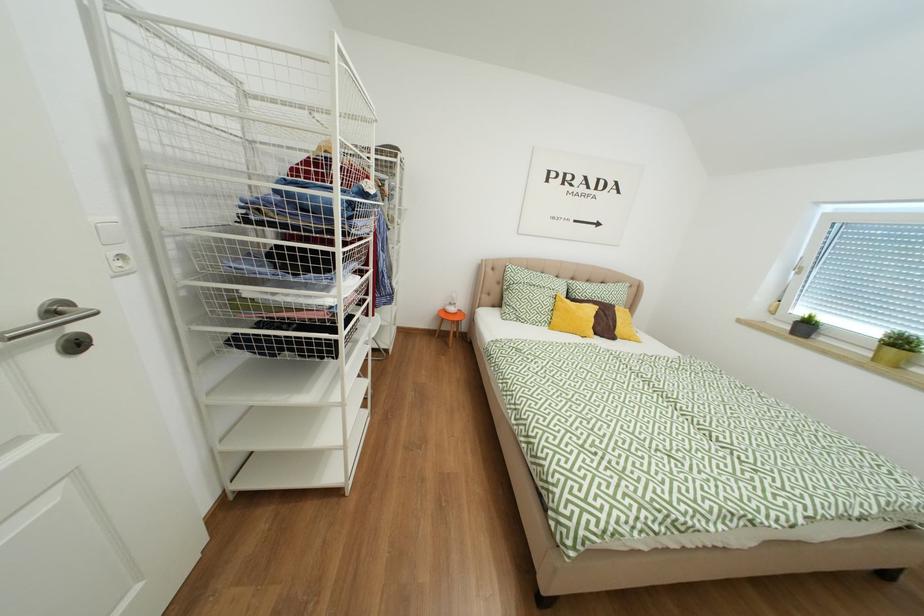
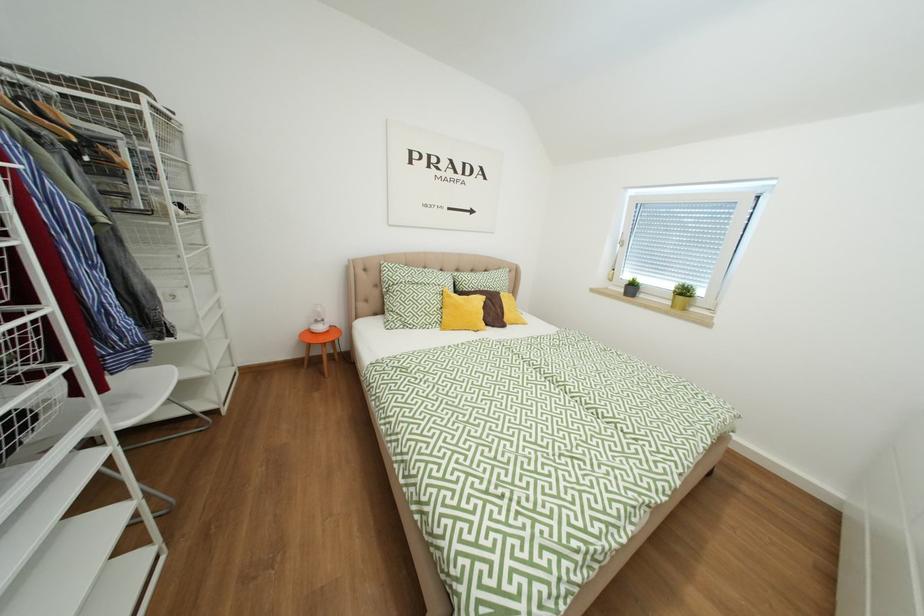
In a continuous first-person perspective shot, in which direction is the camera moving?

The cameraman walked toward right, forward.